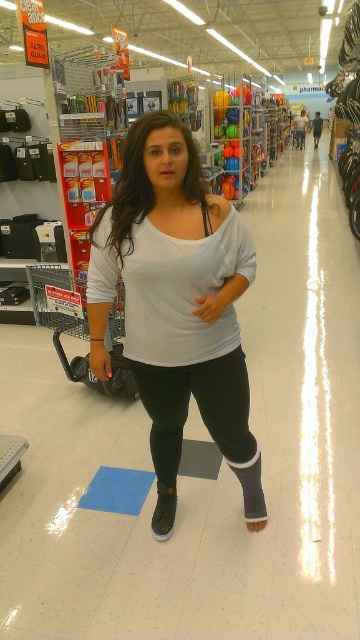
Question: Is white matte shirt at center below black matte leggings at center?

Choices:
 (A) no
 (B) yes

Answer: (A)

Question: Which object appears closest to the camera in this image?

Choices:
 (A) black matte leggings at center
 (B) white matte shirt at center

Answer: (B)

Question: Considering the relative positions of white matte shirt at center and black matte leggings at center in the image provided, where is white matte shirt at center located with respect to black matte leggings at center?

Choices:
 (A) right
 (B) left

Answer: (B)

Question: Does white matte shirt at center appear over black matte leggings at center?

Choices:
 (A) no
 (B) yes

Answer: (B)

Question: Which of the following is the farthest from the observer?

Choices:
 (A) white matte shirt at center
 (B) black matte leggings at center

Answer: (B)